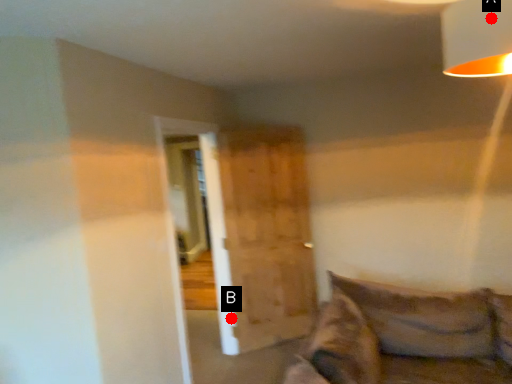
Question: Two points are circled on the image, labeled by A and B beside each circle. Which of the following is the closest to the observer?

Choices:
 (A) A is closer
 (B) B is closer

Answer: (A)